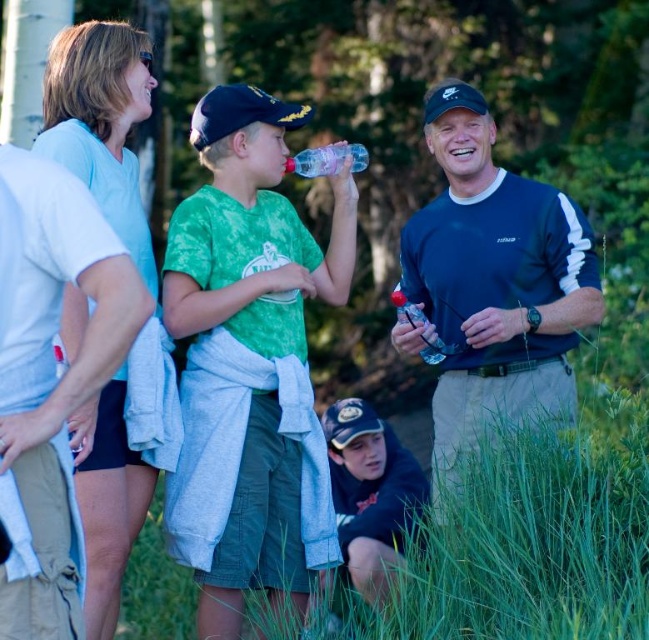
Question: Can you confirm if green tie-dye t-shirt at center is positioned to the left of dark blue baseball cap at lower center?

Choices:
 (A) yes
 (B) no

Answer: (A)

Question: Among these points, which one is nearest to the camera?

Choices:
 (A) (45, 198)
 (B) (271, 534)
 (C) (393, 300)
 (D) (337, 483)

Answer: (A)

Question: Does dark blue sweatshirt at center come in front of translucent plastic bottle at center?

Choices:
 (A) no
 (B) yes

Answer: (B)

Question: Does green tie-dye t-shirt at center appear under dark blue baseball cap at lower center?

Choices:
 (A) yes
 (B) no

Answer: (B)

Question: Which of the following is the closest to the observer?

Choices:
 (A) (101, 355)
 (B) (552, 317)
 (C) (374, 467)

Answer: (A)

Question: Estimate the real-world distances between objects in this image. Which object is farther from the dark blue sweatshirt at center?

Choices:
 (A) dark blue baseball cap at lower center
 (B) white cotton shirt at upper left

Answer: (B)